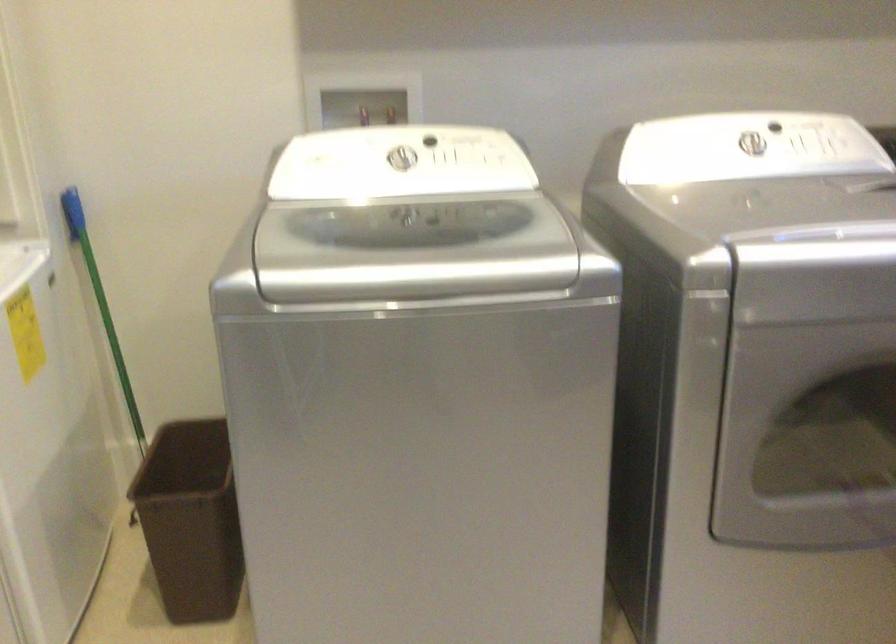
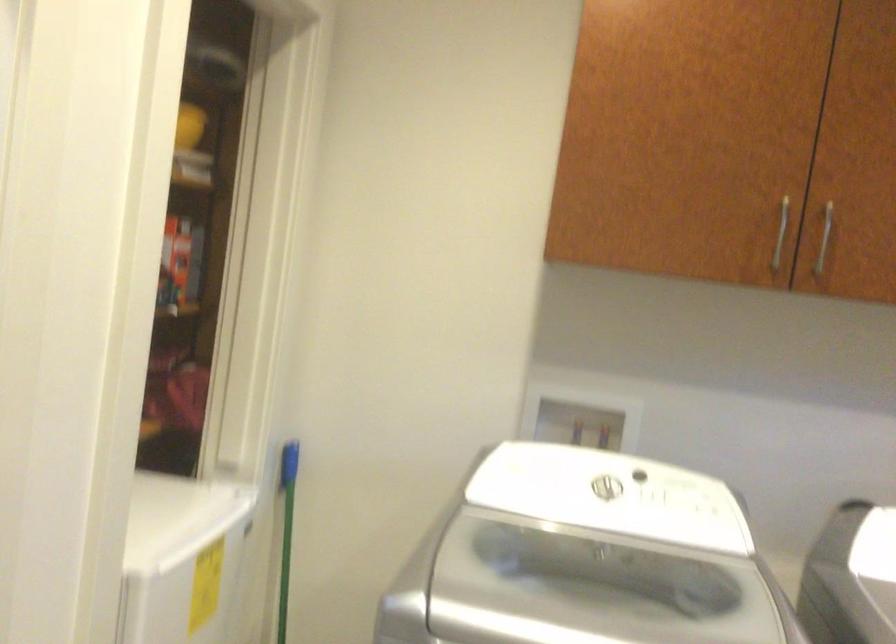
Locate, in the second image, the point that corresponds to point (407, 164) in the first image.

(609, 495)